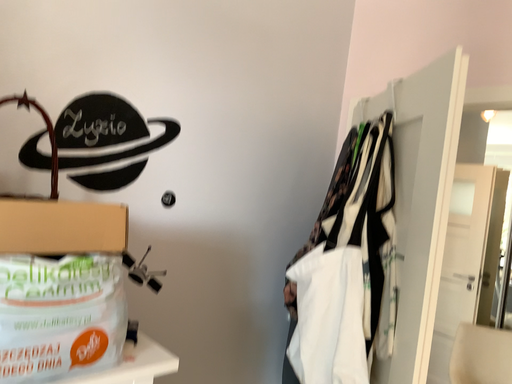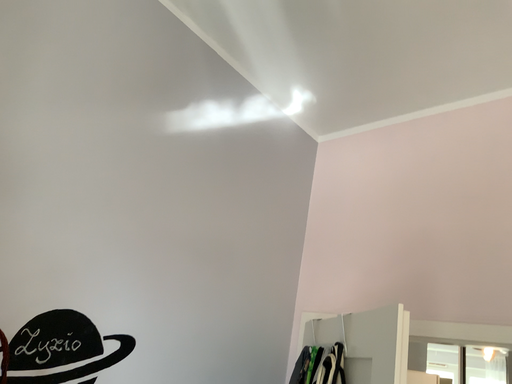
Question: Which way did the camera rotate in the video?

Choices:
 (A) rotated right
 (B) rotated left

Answer: (A)